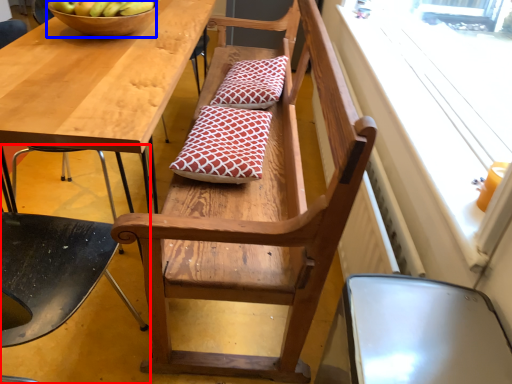
Question: Which object appears closest to the camera in this image, chair (highlighted by a red box) or bowl (highlighted by a blue box)?

Choices:
 (A) chair
 (B) bowl

Answer: (A)